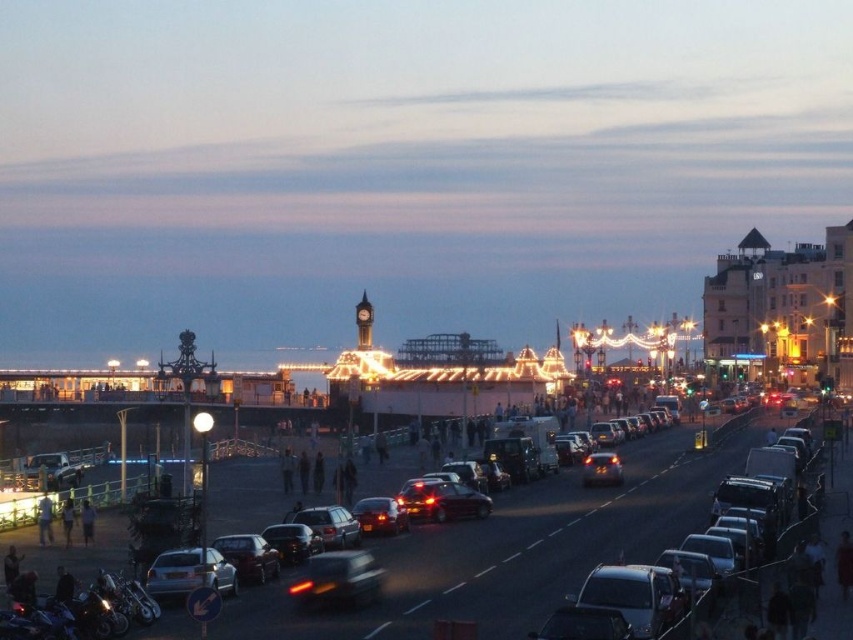
Question: Observing the image, what is the correct spatial positioning of shiny black sedan at center in reference to light brown leather jacket at lower left?

Choices:
 (A) right
 (B) left

Answer: (A)

Question: Which of the following is the farthest from the observer?

Choices:
 (A) (314, 576)
 (B) (479, 589)
 (C) (209, 577)

Answer: (B)

Question: Is shiny black sedan at center to the right of light brown leather jacket at lower left from the viewer's perspective?

Choices:
 (A) no
 (B) yes

Answer: (B)

Question: Which of the following is the closest to the observer?

Choices:
 (A) shiny silver car at center
 (B) shiny black sedan at center

Answer: (A)

Question: Which of the following is the farthest from the observer?

Choices:
 (A) (39, 531)
 (B) (599, 472)
 (C) (223, 538)
 (D) (90, 524)

Answer: (B)

Question: Can you confirm if shiny chrome motorcycle at lower left is thinner than shiny black sedan at center?

Choices:
 (A) yes
 (B) no

Answer: (B)